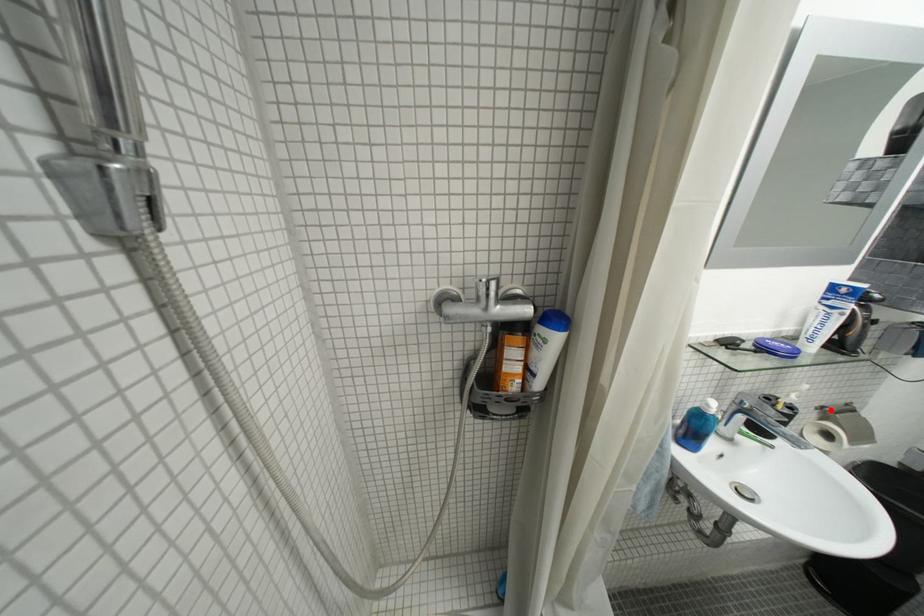
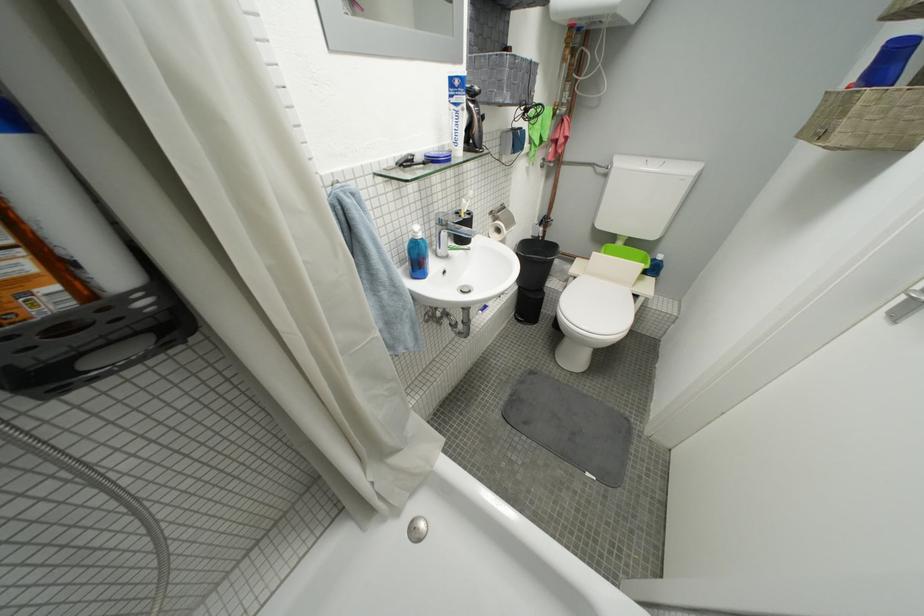
Question: A red point is marked in image1. In image2, is the corresponding 3D point closer to the camera or farther? Reply with the corresponding letter.

Choices:
 (A) The corresponding 3D point is closer.
 (B) The corresponding 3D point is farther.

Answer: (B)